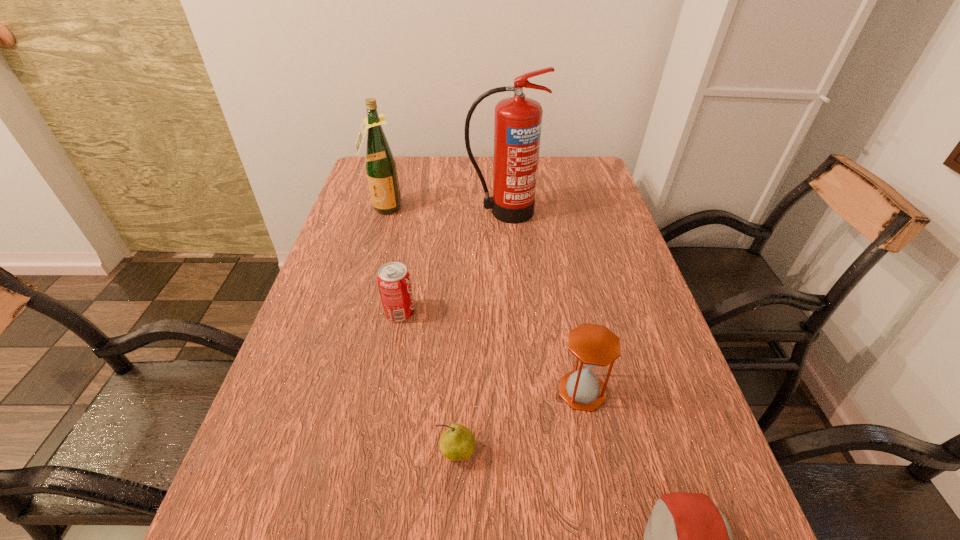
The height and width of the screenshot is (540, 960). I want to click on free space located on the back of the third nearest object, so click(564, 298).

The height and width of the screenshot is (540, 960). In order to click on free space located on the back of the soda can in this screenshot , I will do `click(413, 241)`.

At what (x,y) coordinates should I click in order to perform the action: click on free location located on the left of the pear. Please return your answer as a coordinate pair (x, y). This screenshot has height=540, width=960. Looking at the image, I should click on (281, 453).

At what (x,y) coordinates should I click in order to perform the action: click on object that is at the left edge. Please return your answer as a coordinate pair (x, y). Image resolution: width=960 pixels, height=540 pixels. Looking at the image, I should click on (380, 164).

This screenshot has height=540, width=960. I want to click on object that is at the right edge, so click(x=594, y=345).

This screenshot has height=540, width=960. I want to click on vacant area at the far edge, so click(x=467, y=159).

In order to click on vacant space at the left edge of the desktop in this screenshot , I will do `click(361, 231)`.

I want to click on free region at the right edge of the desktop, so click(626, 325).

The height and width of the screenshot is (540, 960). In the image, there is a desktop. What are the coordinates of `vacant region at the far left corner` in the screenshot? It's located at (366, 191).

At what (x,y) coordinates should I click in order to perform the action: click on empty space that is in between the second object from left to right and the fire extinguisher. Please return your answer as a coordinate pair (x, y). The height and width of the screenshot is (540, 960). Looking at the image, I should click on (451, 262).